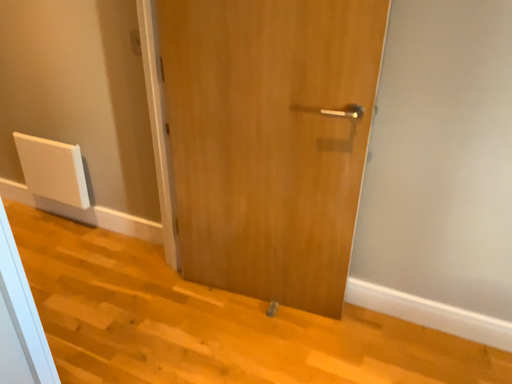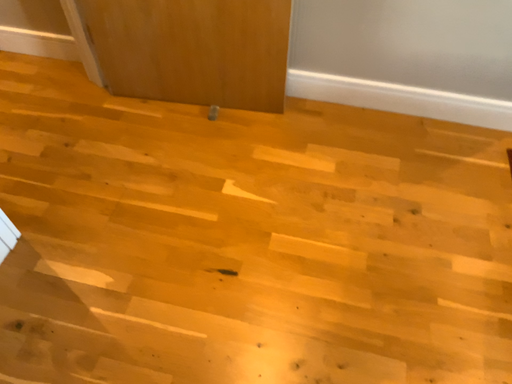
Question: Which way did the camera rotate in the video?

Choices:
 (A) rotated upward
 (B) rotated downward

Answer: (B)